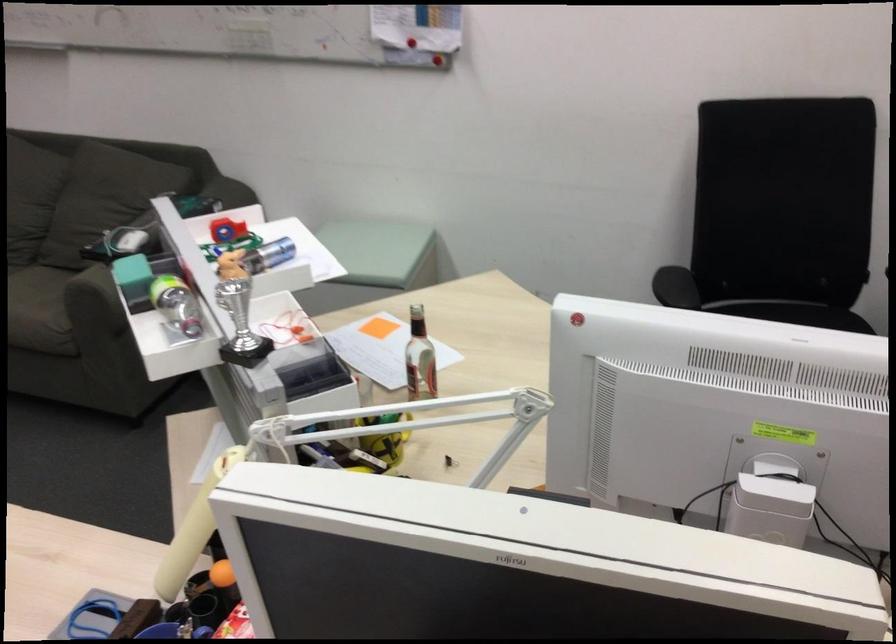
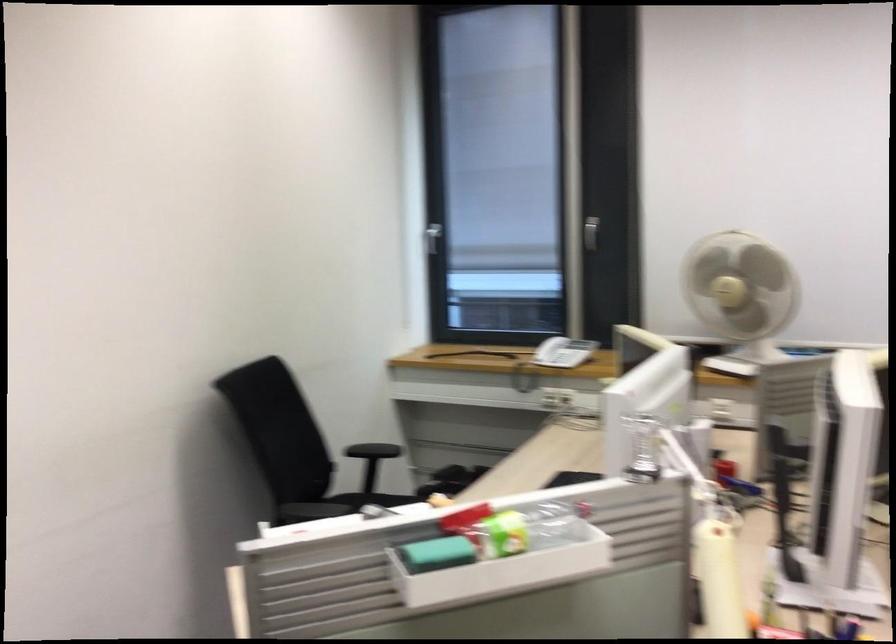
Question: I am providing you with two images of the same scene from different viewpoints. Which of the following objects are not visible in image2?

Choices:
 (A) green sponge
 (B) white desk fan
 (C) skylight window handle
 (D) black chair armrest

Answer: (D)